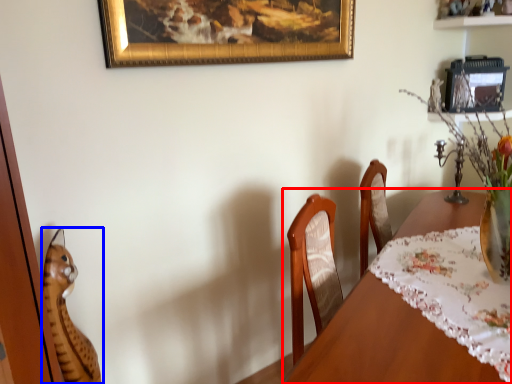
Question: Among these objects, which one is nearest to the camera, table (highlighted by a red box) or cat (highlighted by a blue box)?

Choices:
 (A) table
 (B) cat

Answer: (A)